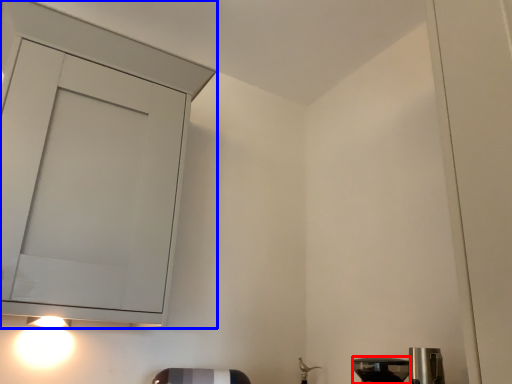
Question: Which point is further to the camera, appliance (highlighted by a red box) or cabinetry (highlighted by a blue box)?

Choices:
 (A) appliance
 (B) cabinetry

Answer: (A)